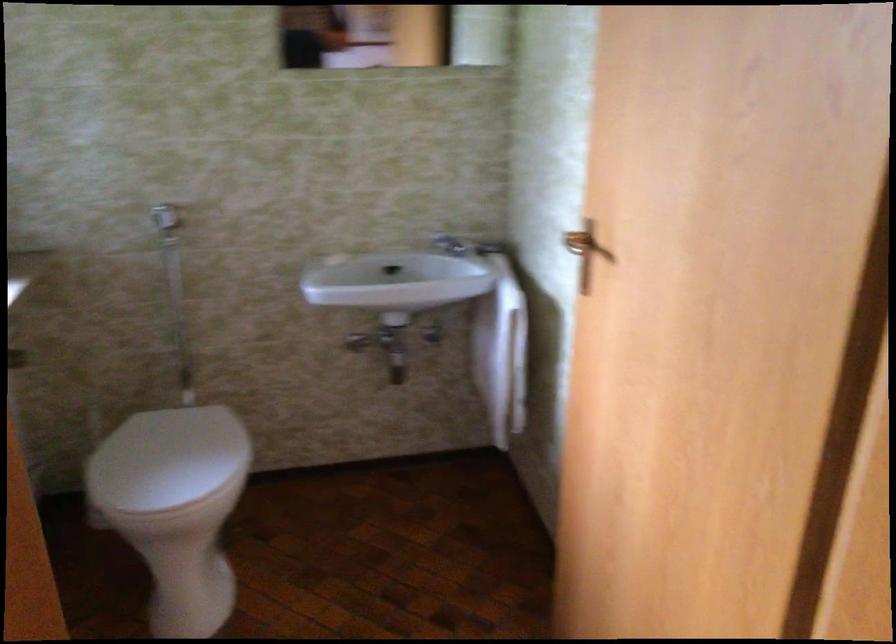
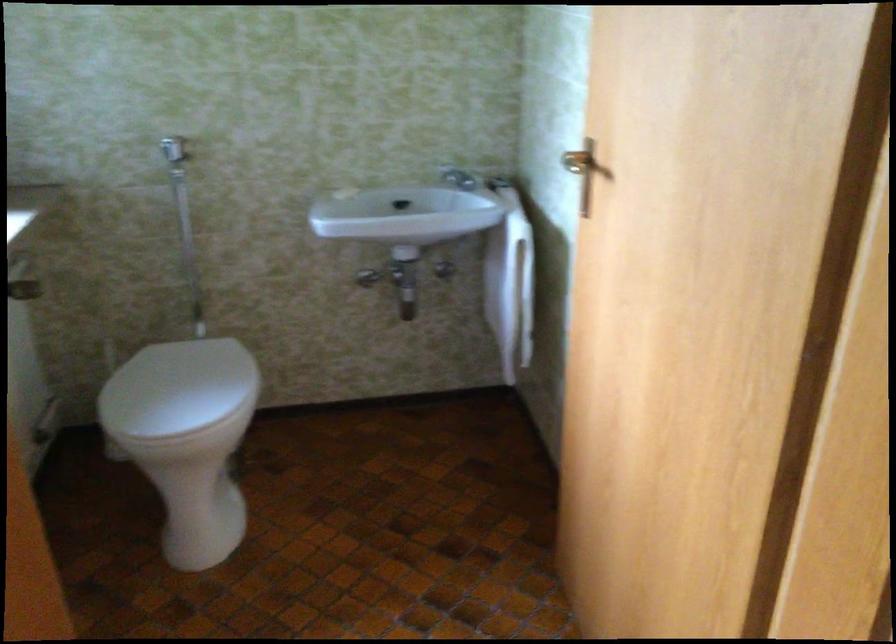
Question: In a continuous first-person perspective shot, in which direction is the camera moving?

Choices:
 (A) Left
 (B) Right
 (C) Forward
 (D) Backward

Answer: (B)